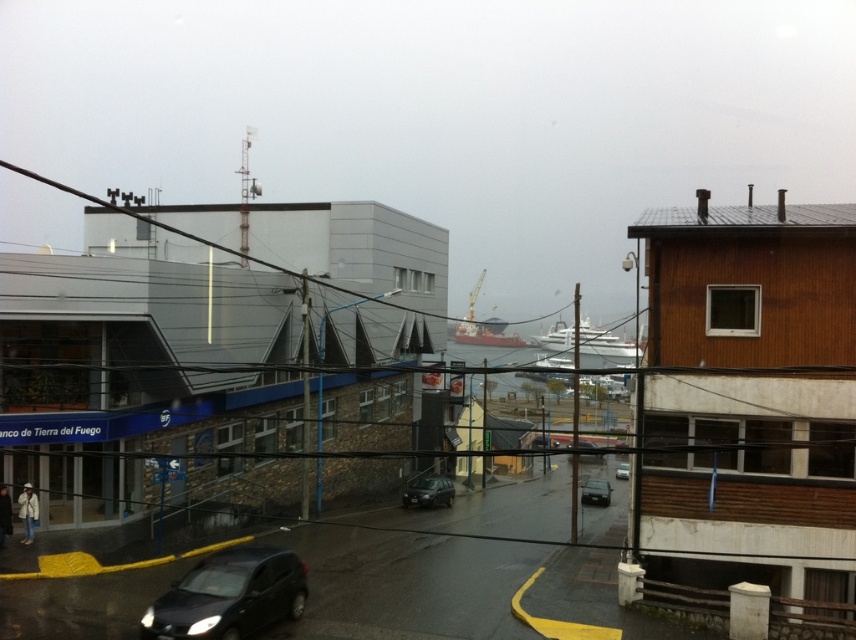
Question: Can you confirm if matte black car at lower left is smaller than matte black car at center?

Choices:
 (A) yes
 (B) no

Answer: (A)

Question: Which point appears closest to the camera in this image?

Choices:
 (A) (622, 477)
 (B) (589, 488)
 (C) (276, 563)

Answer: (C)

Question: Where is matte black car at lower left located in relation to shiny black sedan at center in the image?

Choices:
 (A) below
 (B) above

Answer: (B)

Question: Is matte black car at lower left closer to the viewer compared to shiny black sedan at center?

Choices:
 (A) no
 (B) yes

Answer: (B)

Question: Which point is closer to the camera taking this photo?

Choices:
 (A) (598, 484)
 (B) (621, 467)

Answer: (A)

Question: Which object appears farthest from the camera in this image?

Choices:
 (A) matte black car at center
 (B) matte black car at lower left

Answer: (A)